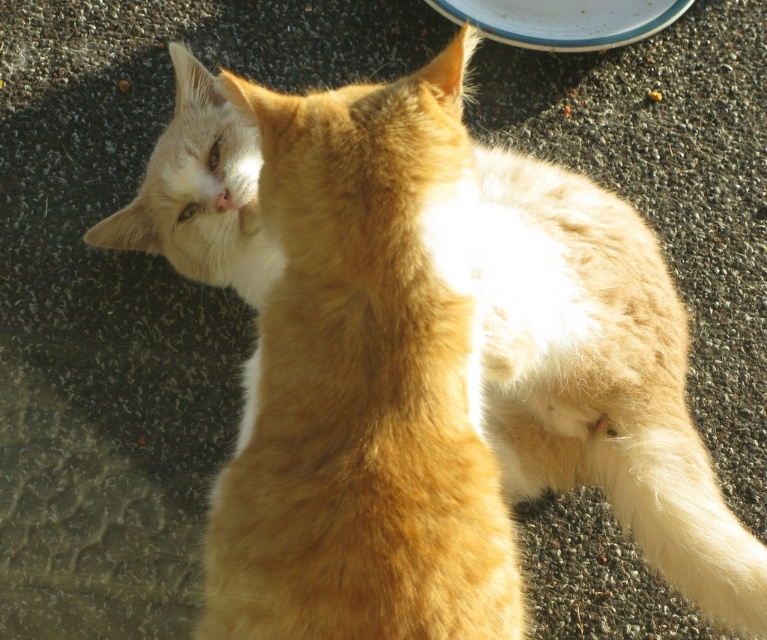
Question: Does white fluffy tail at lower right have a smaller size compared to white glossy plate at upper center?

Choices:
 (A) no
 (B) yes

Answer: (A)

Question: Can you confirm if white fluffy tail at lower right is smaller than white glossy plate at upper center?

Choices:
 (A) no
 (B) yes

Answer: (A)

Question: Which point is closer to the camera?

Choices:
 (A) white glossy plate at upper center
 (B) white fluffy tail at lower right

Answer: (B)

Question: Can you confirm if white fluffy tail at lower right is thinner than white glossy plate at upper center?

Choices:
 (A) no
 (B) yes

Answer: (B)

Question: Which object appears closest to the camera in this image?

Choices:
 (A) white fluffy tail at lower right
 (B) white glossy plate at upper center

Answer: (A)